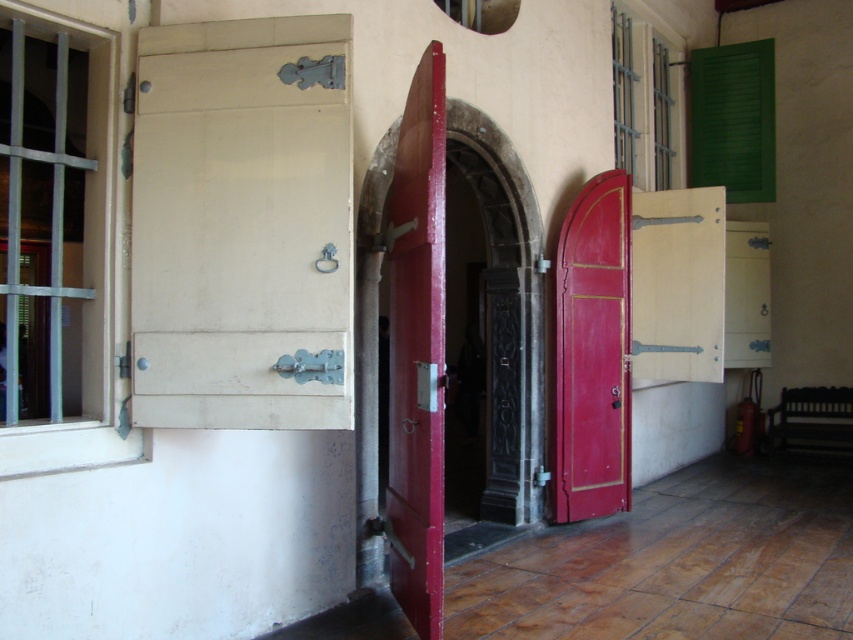
You are an interior designer assessing the space. You need to install a new security system. The system requires a sensor that must be placed on the taller object between the smooth red door at center and the green matte shutter at upper right. Which object should you choose?

The smooth red door at center is taller than the green matte shutter at upper right, so you should place the sensor on the smooth red door at center.

You are an interior designer planning to install a new light fixture. You see the green matte shutter at upper right. Where exactly should you place the fixture to avoid blocking the shutter?

The green matte shutter at upper right is located at coordinates point (733, 120), so place the light fixture away from that position to avoid blocking it.

You are an interior designer planning to install a new light fixture. You have two options to choose from. One is to place it above the smooth red door at center, and the other is above the glossy wood door at center right. Which door should you place the light fixture above if you want it closer to the entrance of the building?

The smooth red door at center is in front of the glossy wood door at center right, so placing the light fixture above the smooth red door at center would position it closer to the entrance of the building.